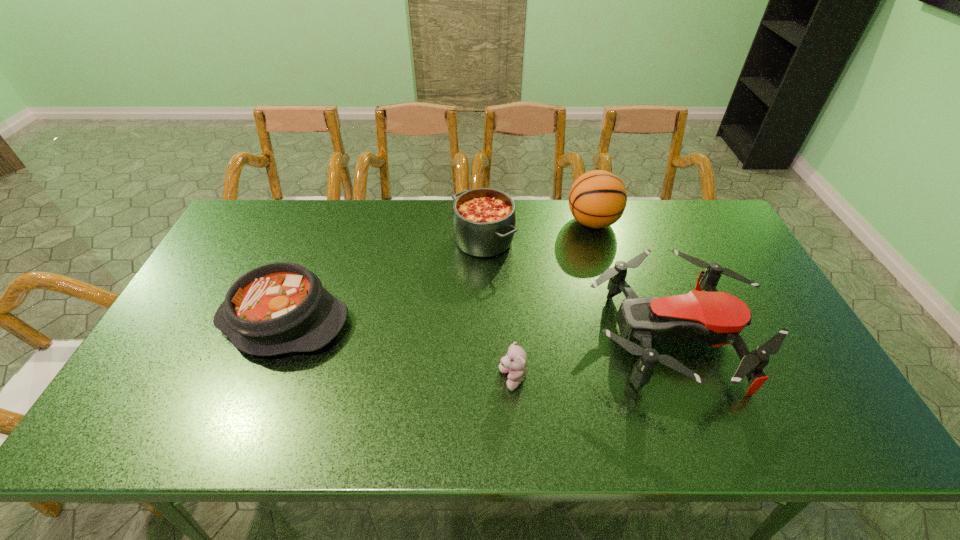
At what (x,y) coordinates should I click in order to perform the action: click on object present at the near right corner. Please return your answer as a coordinate pair (x, y). Looking at the image, I should click on (717, 318).

The height and width of the screenshot is (540, 960). In the image, there is a desktop. What are the coordinates of `vacant space at the far edge` in the screenshot? It's located at (569, 221).

Identify the location of vacant space at the right edge. (705, 258).

You are a GUI agent. You are given a task and a screenshot of the screen. Output one action in this format:
    pyautogui.click(x=<x>, y=<y>)
    Task: Click on the free space at the far left corner of the desktop
    This screenshot has height=540, width=960.
    Given the screenshot: What is the action you would take?
    pyautogui.click(x=241, y=237)

Locate an element on the screen. blank area at the far right corner is located at coordinates (682, 219).

In order to click on empty space between the drone and the left casserole in this screenshot , I will do `click(477, 329)`.

Where is `free area in between the drone and the teddy bear`? This screenshot has height=540, width=960. free area in between the drone and the teddy bear is located at coordinates (591, 359).

Where is `unoccupied area between the shorter casserole and the right casserole`? Image resolution: width=960 pixels, height=540 pixels. unoccupied area between the shorter casserole and the right casserole is located at coordinates (384, 280).

At what (x,y) coordinates should I click in order to perform the action: click on empty space between the basketball and the nearer casserole. Please return your answer as a coordinate pair (x, y). The width and height of the screenshot is (960, 540). Looking at the image, I should click on (439, 272).

Identify the location of free spot between the tallest object and the right casserole. This screenshot has height=540, width=960. (539, 231).